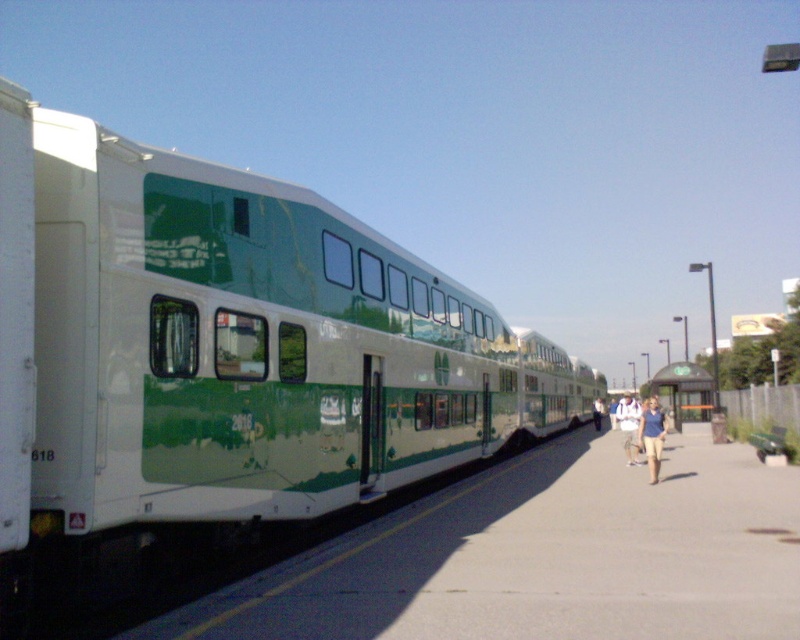
Question: Can you confirm if green glossy train at center is positioned above green matte bus stop at center?

Choices:
 (A) yes
 (B) no

Answer: (A)

Question: Does green glossy train at left have a smaller size compared to green glossy train at center?

Choices:
 (A) yes
 (B) no

Answer: (B)

Question: Which object appears farthest from the camera in this image?

Choices:
 (A) green glossy train at center
 (B) green matte bus stop at center
 (C) green glossy train at left
 (D) light blue shirt at center

Answer: (D)

Question: Where is green glossy train at center located in relation to light blue shirt at center in the image?

Choices:
 (A) above
 (B) below

Answer: (A)

Question: Which of these objects is positioned closest to the light blue shirt at center?

Choices:
 (A) green glossy train at center
 (B) light blue jeans at center
 (C) green matte bus stop at center
 (D) blue cotton shirt at center

Answer: (C)

Question: Which point is closer to the camera taking this photo?

Choices:
 (A) (600, 406)
 (B) (686, 419)
 (C) (644, 420)

Answer: (C)